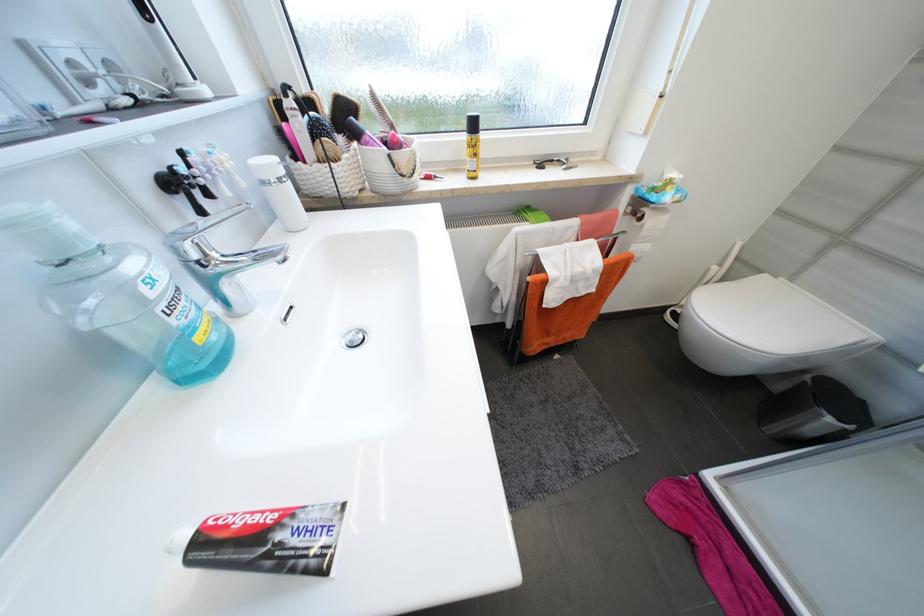
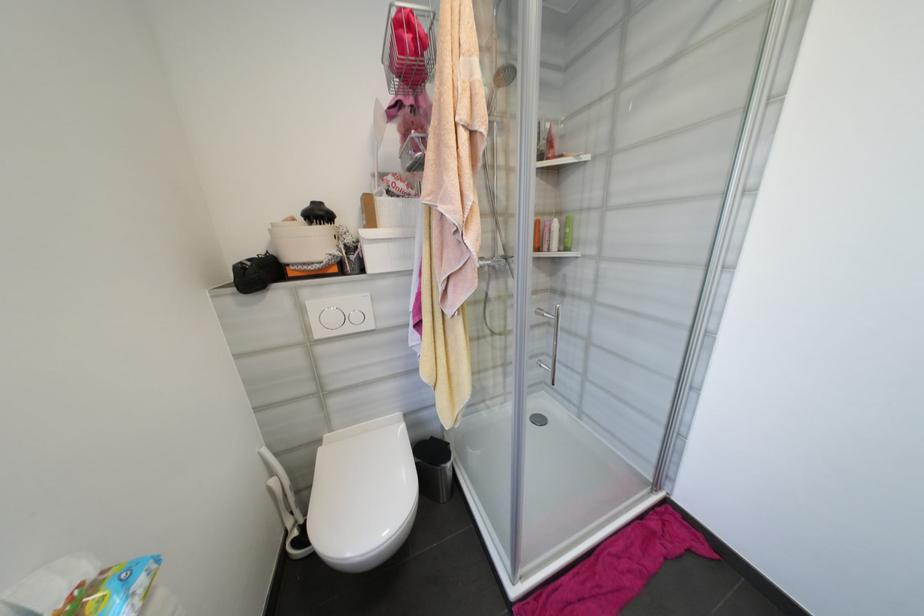
Where in the second image is the point corresponding to point (721, 269) from the first image?

(277, 482)